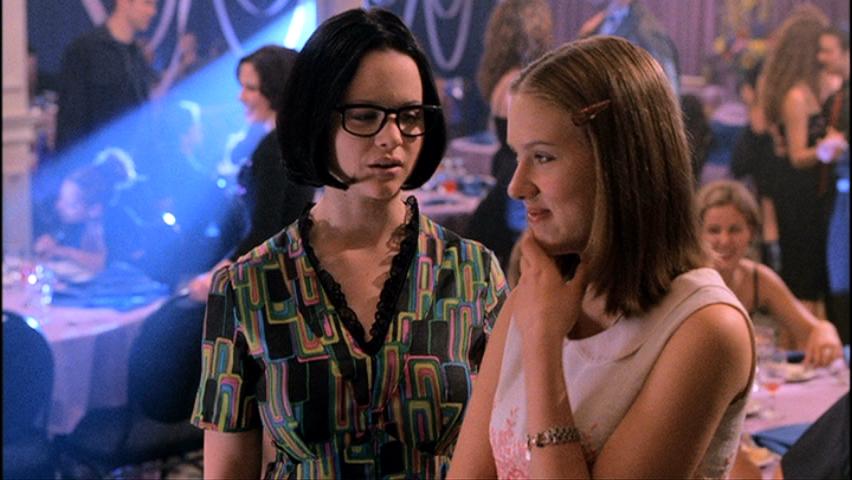
The image size is (852, 480). Find the location of `spotlight`. spotlight is located at coordinates (136, 240), (210, 135), (296, 25).